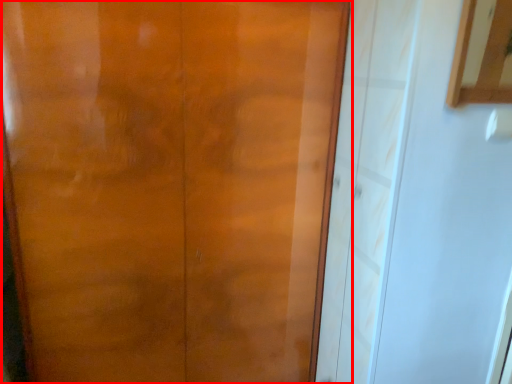
Question: Observing the image, what is the correct spatial positioning of door (annotated by the red box) in reference to cabinetry?

Choices:
 (A) left
 (B) right

Answer: (A)